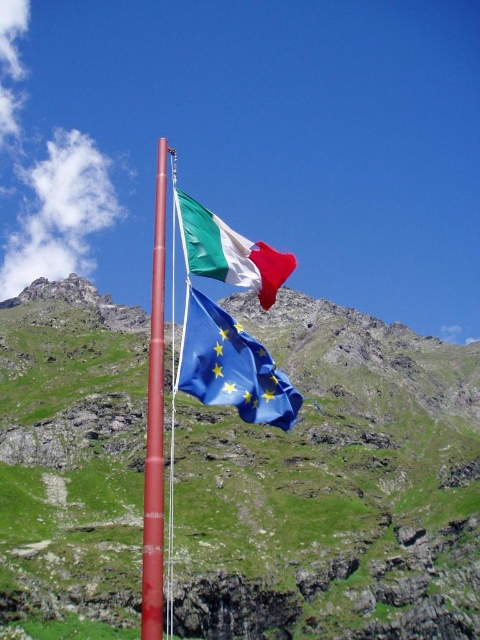
You are a photographer planning to capture a landscape photo of the green grassy mountain at upper center and the matte fabric flag at upper center. Given that you want to emphasize the mountain in your composition, which object should you focus on to ensure it appears larger in the photo?

The green grassy mountain at upper center has a larger size compared to the matte fabric flag at upper center, so focusing on the green grassy mountain at upper center will ensure it appears larger in the photo.